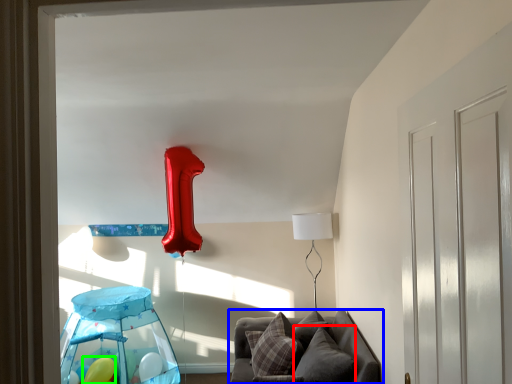
Question: Which object is the closest to the pillow (highlighted by a red box)? Choose among these: furniture (highlighted by a blue box) or balloon (highlighted by a green box).

Choices:
 (A) furniture
 (B) balloon

Answer: (A)